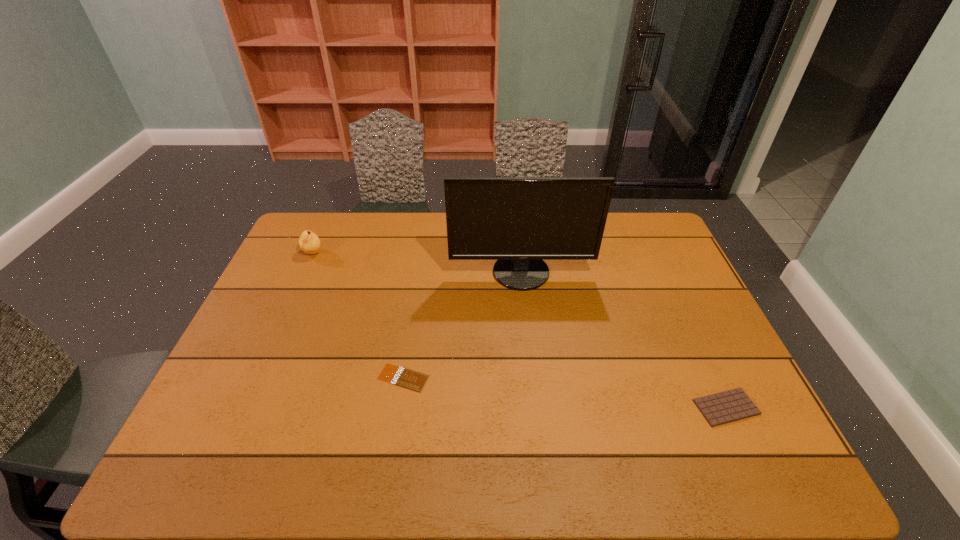
I want to click on free spot between the tallest object and the leftmost object, so click(417, 262).

In order to click on the closest object to the rightmost object in this screenshot , I will do `click(519, 221)`.

Identify the location of object that is the second closest to the pear. (403, 377).

At what (x,y) coordinates should I click in order to perform the action: click on vacant region that satisfies the following two spatial constraints: 1. on the front side of the rightmost object; 2. on the left side of the pear. Please return your answer as a coordinate pair (x, y). The image size is (960, 540). Looking at the image, I should click on (244, 407).

This screenshot has width=960, height=540. Find the location of `blank area in the image that satisfies the following two spatial constraints: 1. on the front side of the pear; 2. on the right side of the rightmost object`. blank area in the image that satisfies the following two spatial constraints: 1. on the front side of the pear; 2. on the right side of the rightmost object is located at coordinates (244, 407).

Image resolution: width=960 pixels, height=540 pixels. I want to click on vacant region that satisfies the following two spatial constraints: 1. on the front side of the second object from left to right; 2. on the right side of the right chocolate bar, so click(398, 407).